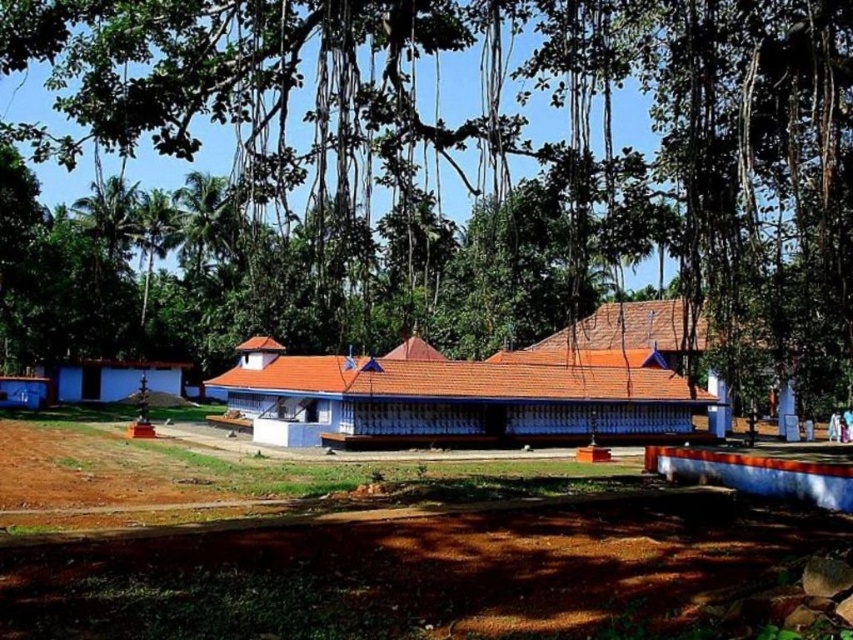
Question: Which of the following is the farthest from the observer?

Choices:
 (A) blue painted wood hut at left
 (B) white painted wood temple at center
 (C) brown soil at lower center
 (D) green leafy tree at upper center

Answer: (A)

Question: Does brown soil at lower center appear under blue painted wood hut at left?

Choices:
 (A) yes
 (B) no

Answer: (B)

Question: Which of the following is the closest to the observer?

Choices:
 (A) green leafy tree at upper center
 (B) brown soil at lower center
 (C) white painted wood temple at center
 (D) blue painted wood hut at left

Answer: (B)

Question: Which of the following is the closest to the observer?

Choices:
 (A) brown soil at lower center
 (B) white painted wood temple at center
 (C) blue painted wood hut at left

Answer: (A)

Question: Can you confirm if green leafy tree at upper center is positioned to the left of brown soil at lower center?

Choices:
 (A) no
 (B) yes

Answer: (A)

Question: Observing the image, what is the correct spatial positioning of brown soil at lower center in reference to white painted wood temple at center?

Choices:
 (A) right
 (B) left

Answer: (A)